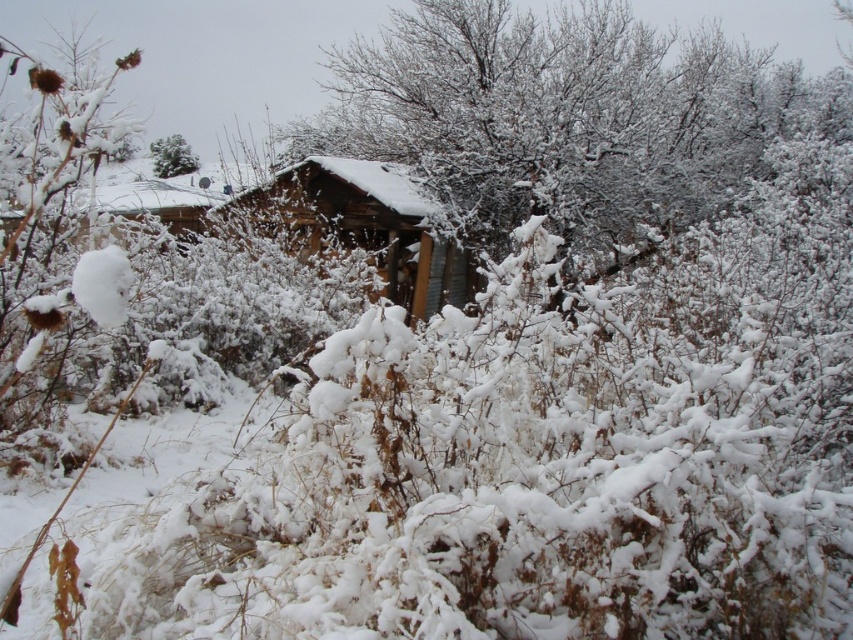
Which is more to the right, snow-covered branches at center or green matte tree at upper left?

snow-covered branches at center

Is point (663, 99) closer to camera compared to point (189, 164)?

Yes, it is.

Find the location of a particular element. The width and height of the screenshot is (853, 640). snow-covered branches at center is located at coordinates (561, 116).

In the scene shown: Between wooden cabin at center and green matte tree at upper left, which one is positioned higher?

green matte tree at upper left is higher up.

Does point (299, 179) come closer to viewer compared to point (167, 161)?

Yes, point (299, 179) is in front of point (167, 161).

Who is more forward, (409, 218) or (175, 150)?

Point (409, 218) is in front.

Find the location of a particular element. Image resolution: width=853 pixels, height=640 pixels. wooden cabin at center is located at coordinates (370, 225).

The image size is (853, 640). Describe the element at coordinates (561, 116) in the screenshot. I see `snow-covered branches at center` at that location.

Between snow-covered branches at center and wooden cabin at center, which one is positioned lower?

wooden cabin at center

Does point (511, 208) lie in front of point (288, 180)?

No, (511, 208) is behind (288, 180).

Identify the location of snow-covered branches at center. The image size is (853, 640). (561, 116).